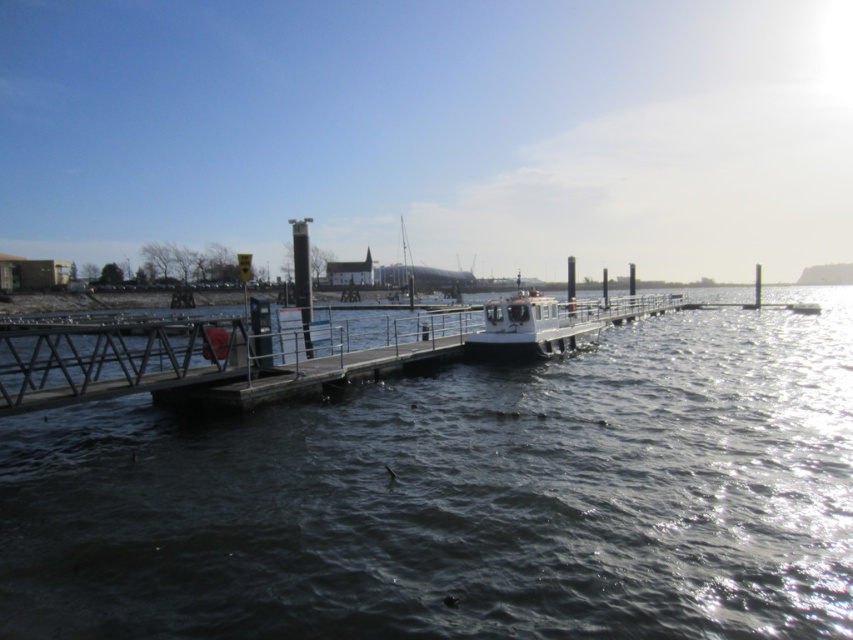
You are standing on the wooden pier and looking down at the scene. Which object is positioned lower in the image between the dark water at center and the white matte boat at center?

The dark water at center is positioned below the white matte boat at center, so it is lower in the image.